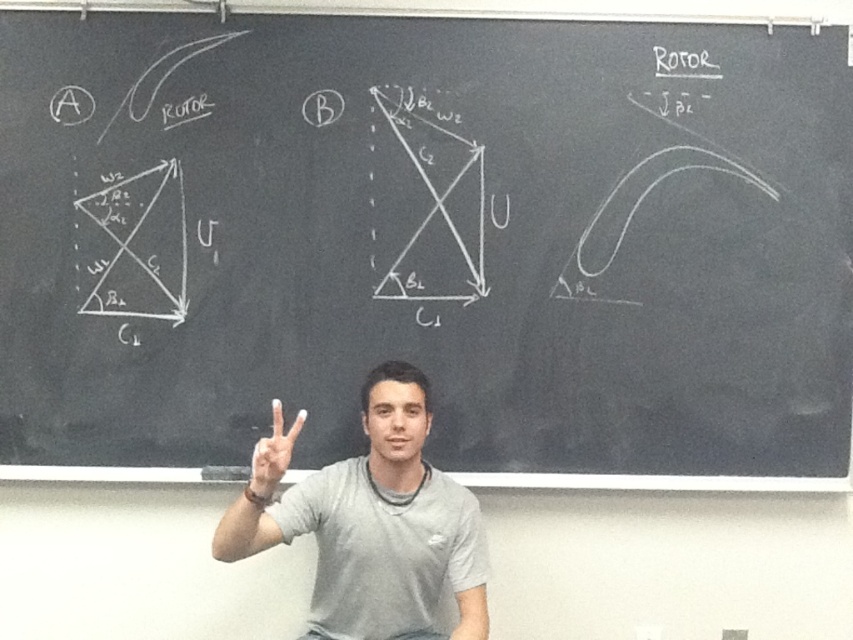
You are an artist trying to paint a portrait of the person in the image. You need to decide which object to focus on first based on their size. Which one should you start with, the gray cotton shirt at center or the white matte hand at center?

The gray cotton shirt at center is larger in size than the white matte hand at center, so you should start with the gray cotton shirt at center first.

You are an assistant helping with a geometry class. You see two points on the chalkboard labeled as point A and point B. The coordinates of point A are given as point A at [428,621] and point B at [260,468]. The professor asks which point is closer to the viewer. What do you tell them?

Point A at [428,621] is further to the viewer than point B at [260,468]. Therefore, point B is closer to the viewer.

You are an artist trying to draw this scene. You need to decide which object to sketch first based on their sizes. Which is wider, the gray cotton shirt at center or the white matte hand at center?

The gray cotton shirt at center is wider than the white matte hand at center, so you should sketch the gray cotton shirt at center first if focusing on larger elements first.